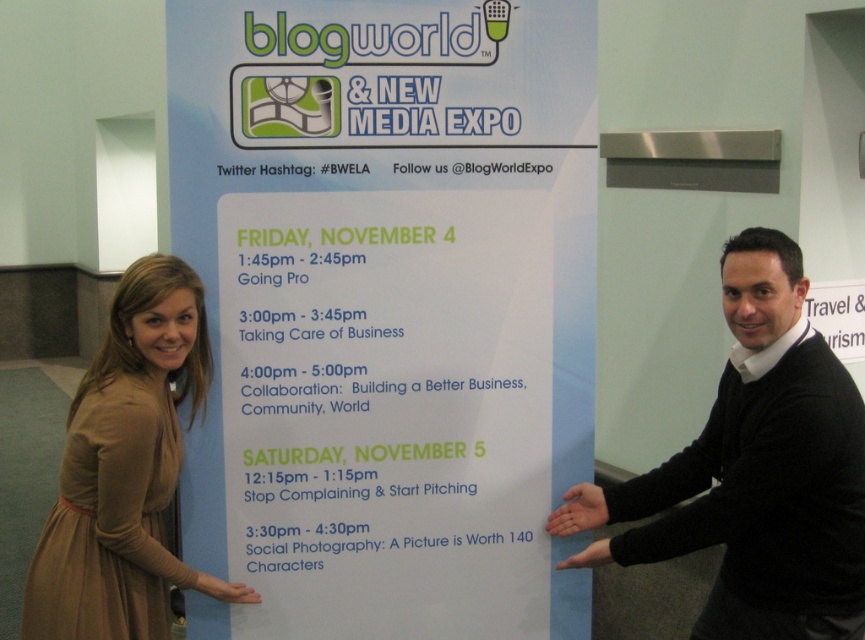
How far apart are black sweater at right and brown fabric dress at lower left?

black sweater at right is 3.90 feet from brown fabric dress at lower left.

Is the position of black sweater at right more distant than that of brown fabric dress at lower left?

No, black sweater at right is closer to the viewer.

Describe the element at coordinates (755, 470) in the screenshot. I see `black sweater at right` at that location.

Locate an element on the screen. This screenshot has height=640, width=865. black sweater at right is located at coordinates (x=755, y=470).

Can you confirm if white paper poster at center is positioned above black sweater at right?

Yes.

Which is above, white paper poster at center or black sweater at right?

white paper poster at center is higher up.

Image resolution: width=865 pixels, height=640 pixels. What are the coordinates of `white paper poster at center` in the screenshot? It's located at (388, 308).

Locate an element on the screen. This screenshot has height=640, width=865. white paper poster at center is located at coordinates (388, 308).

Can you confirm if white paper poster at center is smaller than brown fabric dress at lower left?

No, white paper poster at center is not smaller than brown fabric dress at lower left.

Does white paper poster at center appear on the left side of brown fabric dress at lower left?

Incorrect, white paper poster at center is not on the left side of brown fabric dress at lower left.

The width and height of the screenshot is (865, 640). Find the location of `white paper poster at center`. white paper poster at center is located at coordinates (388, 308).